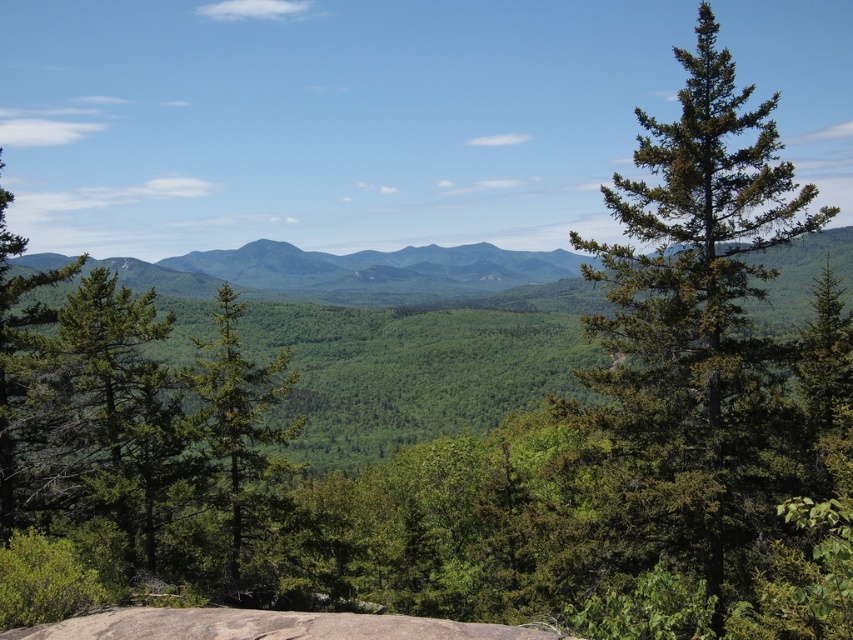
Question: Which point is closer to the camera?

Choices:
 (A) (497, 627)
 (B) (706, 280)
 (C) (163, 289)
 (D) (233, 332)

Answer: (A)

Question: Which of the following is the closest to the observer?

Choices:
 (A) green needle-like at right
 (B) green forested mountain at center
 (C) gray rock at lower center

Answer: (A)

Question: Can you confirm if green needle-like at right is positioned to the right of gray rock at lower center?

Choices:
 (A) no
 (B) yes

Answer: (B)

Question: Considering the relative positions of green needle-like at right and green matte tree at center in the image provided, where is green needle-like at right located with respect to green matte tree at center?

Choices:
 (A) above
 (B) below

Answer: (A)

Question: Does green forested mountain at center appear under green matte tree at center?

Choices:
 (A) no
 (B) yes

Answer: (A)

Question: Which of these objects is positioned farthest from the green needle-like at right?

Choices:
 (A) green forested mountain at center
 (B) green matte tree at center

Answer: (A)